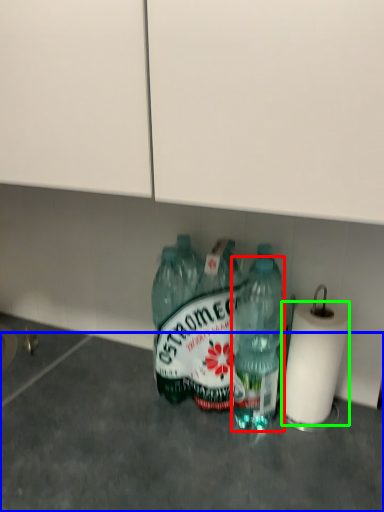
Question: Estimate the real-world distances between objects in this image. Which object is closer to bottle (highlighted by a red box), concrete (highlighted by a blue box) or paper towel (highlighted by a green box)?

Choices:
 (A) concrete
 (B) paper towel

Answer: (B)